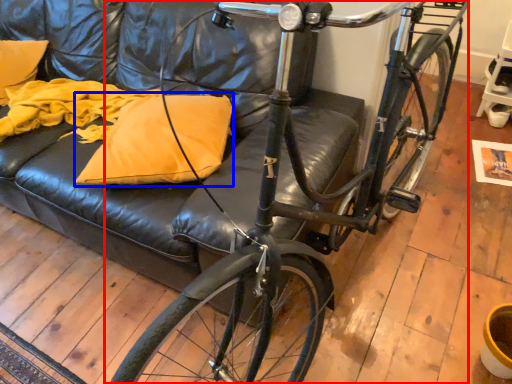
Question: Which object is closer to the camera taking this photo, bicycle (highlighted by a red box) or pillow (highlighted by a blue box)?

Choices:
 (A) bicycle
 (B) pillow

Answer: (A)